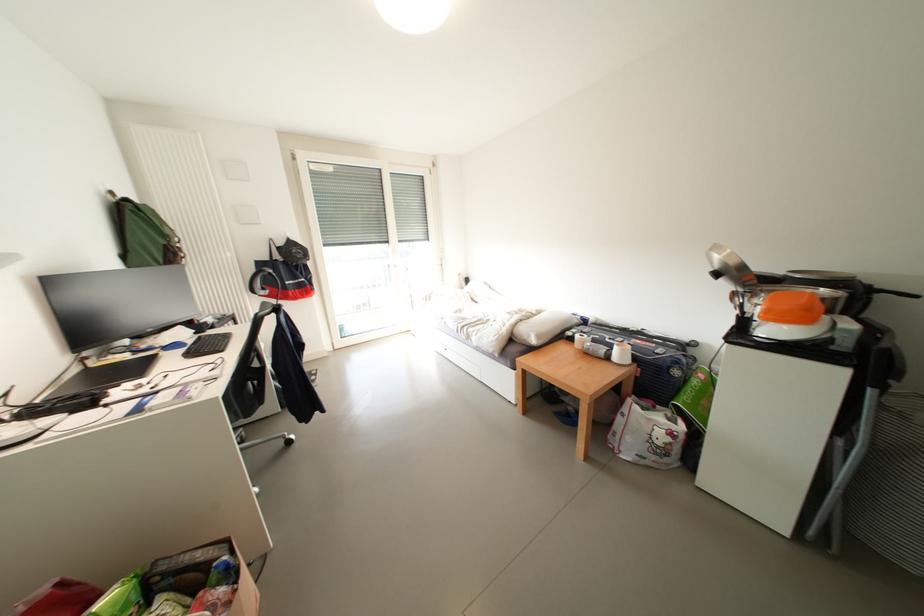
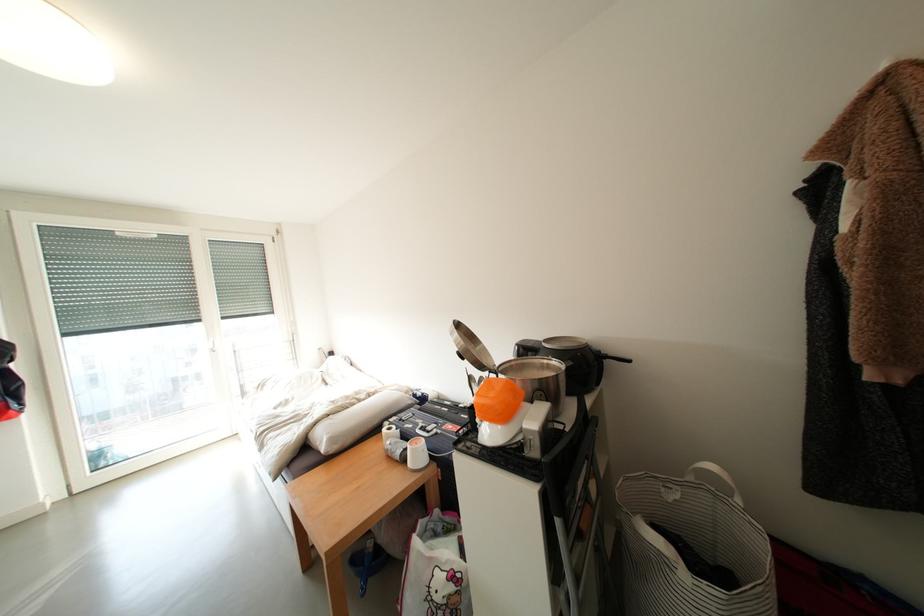
The point at (852, 350) is marked in the first image. Where is the corresponding point in the second image?

(541, 455)